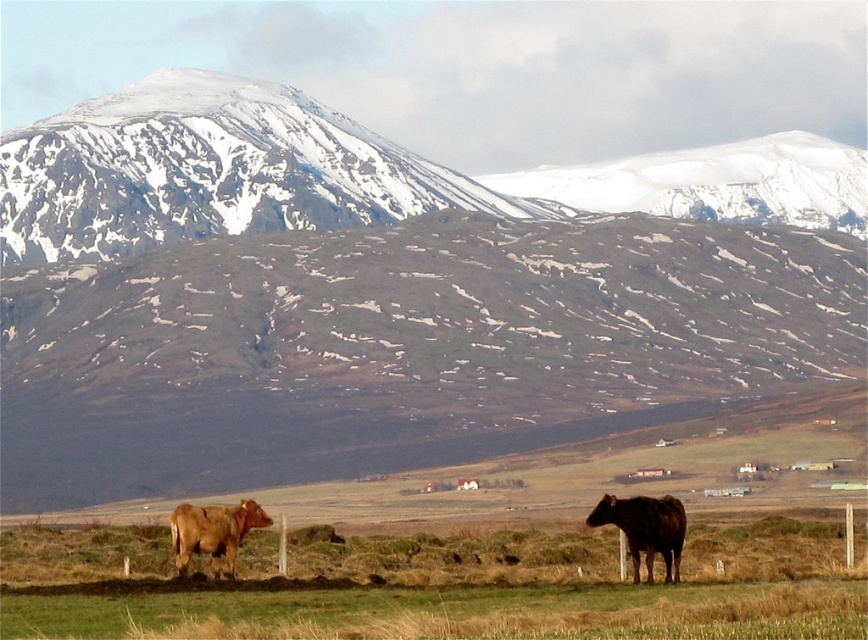
Question: Among these points, which one is nearest to the camera?

Choices:
 (A) [x=237, y=515]
 (B) [x=646, y=506]

Answer: (B)

Question: Among these objects, which one is nearest to the camera?

Choices:
 (A) snowy rock mountain range at upper center
 (B) snowy rock mountain at upper left

Answer: (A)

Question: Where is snowy rock mountain range at upper center located in relation to snowy rock mountain at upper left in the image?

Choices:
 (A) right
 (B) left

Answer: (A)

Question: Among these points, which one is farthest from the camera?

Choices:
 (A) (62, 276)
 (B) (217, 508)
 (C) (610, 512)

Answer: (A)

Question: Can you confirm if brown glossy cow at lower right is bigger than brown matte cow at lower left?

Choices:
 (A) yes
 (B) no

Answer: (B)

Question: Does snowy rock mountain at upper left have a greater width compared to brown matte cow at lower left?

Choices:
 (A) yes
 (B) no

Answer: (A)